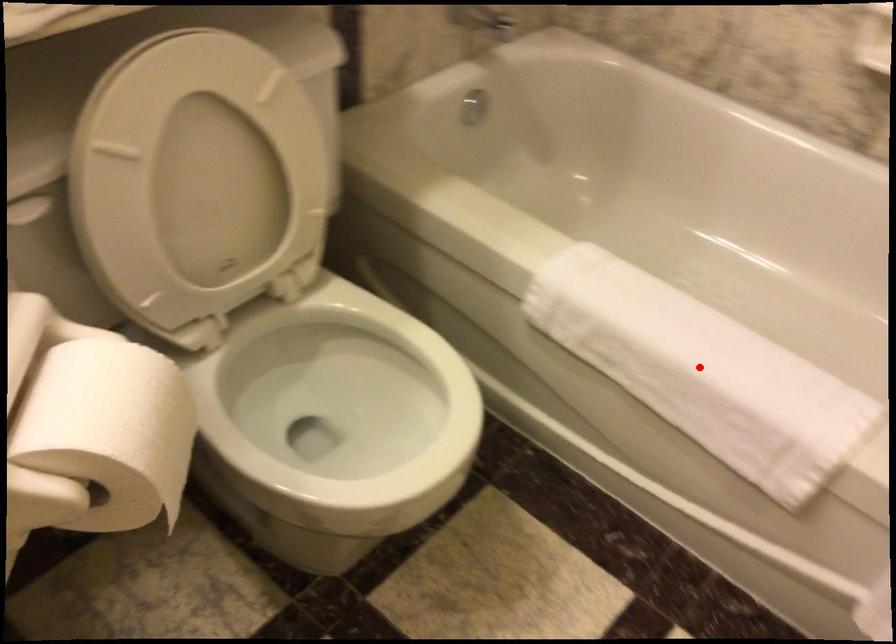
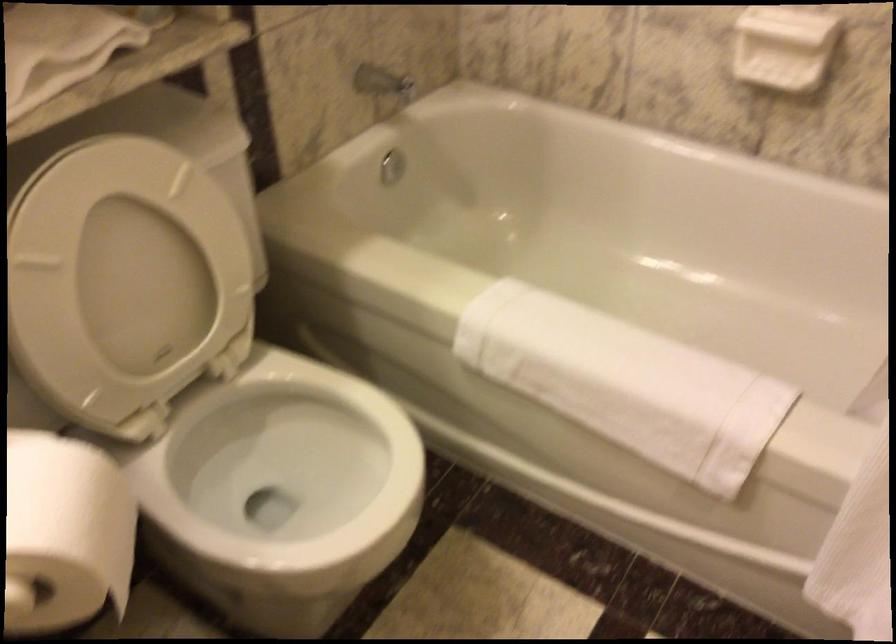
Question: I am providing you with two images of the same scene from different viewpoints. A red point is marked on the first image. Can you still see the location of the red point in image 2?

Choices:
 (A) Yes
 (B) No

Answer: (A)